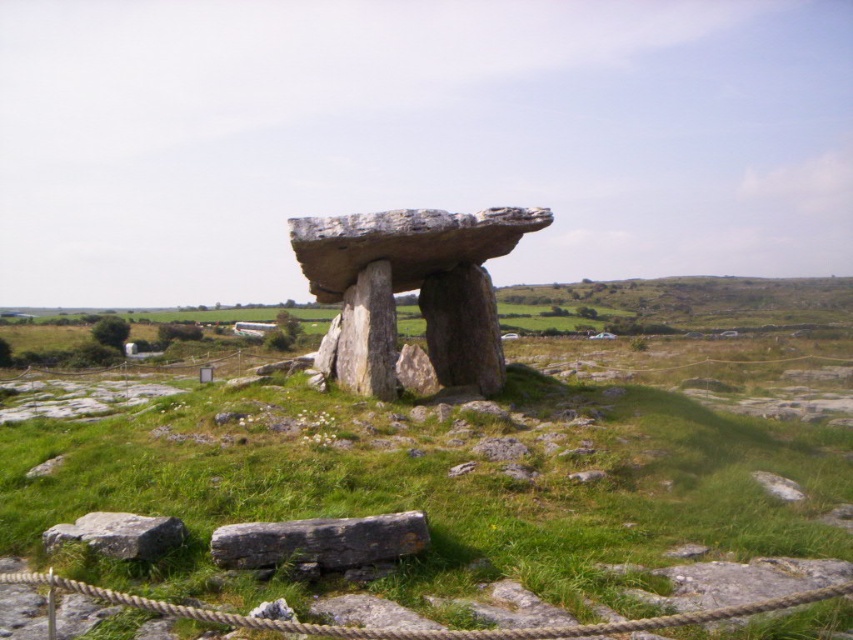
Question: Can you confirm if rough stone dolmen at center is wider than gray rough stone at lower left?

Choices:
 (A) no
 (B) yes

Answer: (B)

Question: Which of the following is the farthest from the observer?

Choices:
 (A) (294, 220)
 (B) (302, 556)
 (C) (114, 522)

Answer: (A)

Question: Which object is closer to the camera taking this photo?

Choices:
 (A) gray rough stone at lower left
 (B) green grassy at center
 (C) roperough at lower center

Answer: (C)

Question: In this image, where is roperough at lower center located relative to gray rough stone at lower center?

Choices:
 (A) right
 (B) left

Answer: (A)

Question: Which object is closer to the camera taking this photo?

Choices:
 (A) rough stone dolmen at center
 (B) roperough at lower center

Answer: (B)

Question: Considering the relative positions of green grassy at center and rough stone dolmen at center in the image provided, where is green grassy at center located with respect to rough stone dolmen at center?

Choices:
 (A) right
 (B) left

Answer: (B)